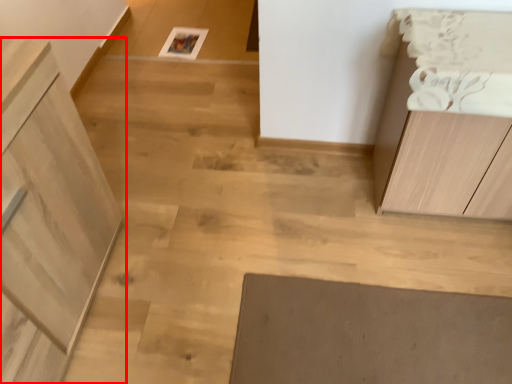
Question: From the image, what is the correct spatial relationship of cabinetry (annotated by the red box) in relation to cabinetry?

Choices:
 (A) right
 (B) left

Answer: (B)